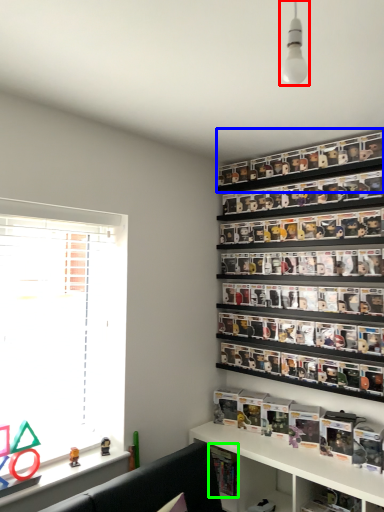
Question: Estimate the real-world distances between objects in this image. Which object is closer to light fixture (highlighted by a red box), shelf (highlighted by a blue box) or book (highlighted by a green box)?

Choices:
 (A) shelf
 (B) book

Answer: (A)